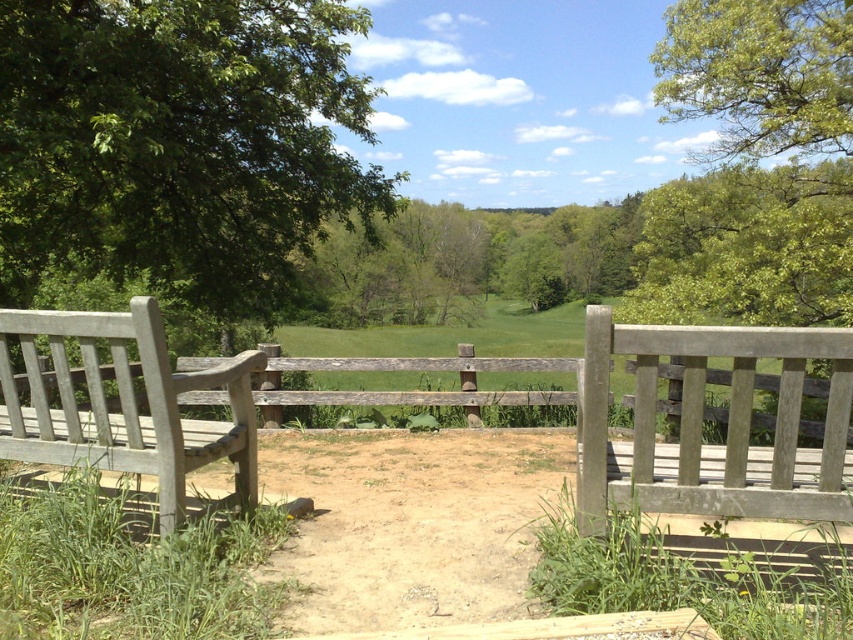
You are standing on a wooden bridge and see the green leafy tree at upper left and the green leafy tree at upper right. Which tree would appear closer to you?

The green leafy tree at upper left appears closer because it has a smaller size compared to the green leafy tree at upper right.

You are standing on the wooden bridge and want to walk towards the two points marked in the image. Which point, point (x=338, y=61) or point (x=766, y=108), should you reach first?

Point (x=338, y=61) is in front of point (x=766, y=108), so you should reach point (x=338, y=61) first.

You are standing on a wooden bridge and see a point marked at coordinates (178, 144). What object is located at that point?

The point at coordinates (178, 144) indicates the location of the green leafy tree at upper left.